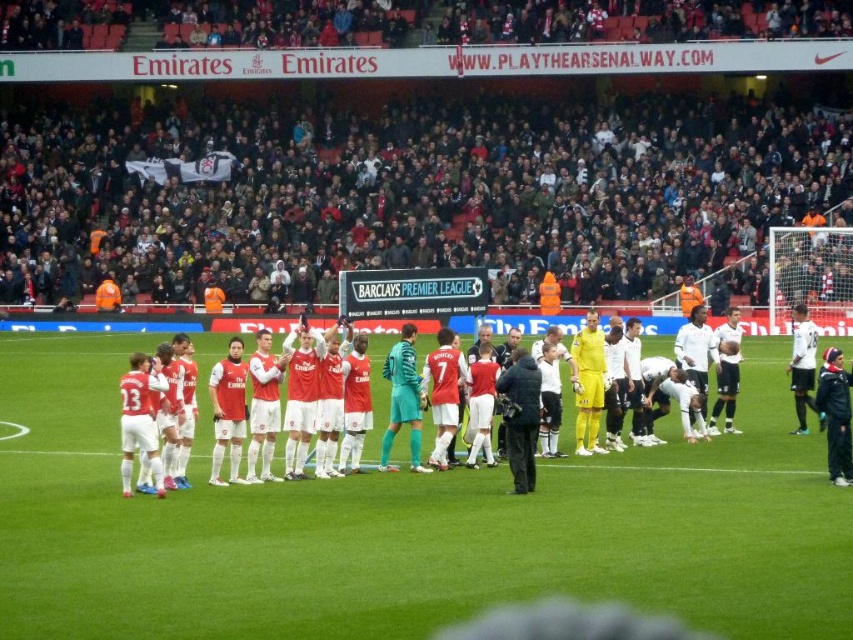
You are a photographer standing at the edge of the Emirates Stadium pitch. You want to take a photo that includes both the dark gray crowd at upper center and the matte red jersey at center. Which object should you adjust your camera focus to first to ensure both are in the frame?

You should focus on the dark gray crowd at upper center first since it is closer to you than the matte red jersey at center, allowing you to adjust the framing to include both.

You are a photographer positioned at the center of the Emirates Stadium pitch. You want to capture a closeup shot of the matte red jersey at center located at point (306, 372). Is there any obstruction between your current position and the matte red jersey at center?

There is no obstruction between your current position at the center of the Emirates Stadium pitch and the matte red jersey at center located at point (306, 372), so you can take the closeup shot without any issues.

You are standing at the point labeled as point [498,112] in the Emirates Stadium. If you want to move 100 feet towards the pitch, will you be able to reach the pitch?

The distance of point [498,112] from viewer is 155.16 feet. Moving 100 feet towards the pitch would leave you 55.16 feet away from the pitch. Therefore, you won t reach the pitch.